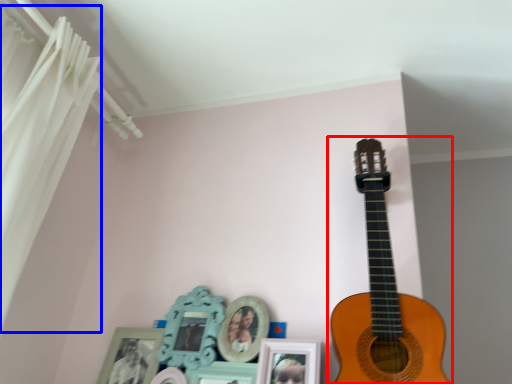
Question: Which of the following is the farthest to the observer, guitar (highlighted by a red box) or curtain (highlighted by a blue box)?

Choices:
 (A) guitar
 (B) curtain

Answer: (A)